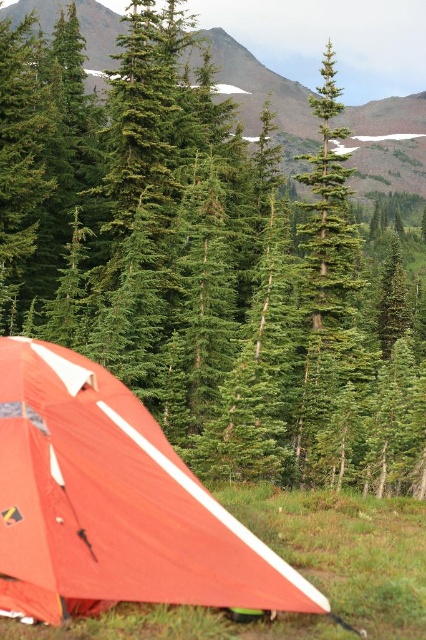
Question: Is orange fabric tent at lower left smaller than green textured pine tree at center?

Choices:
 (A) no
 (B) yes

Answer: (B)

Question: Which point is closer to the camera?

Choices:
 (A) (250, 58)
 (B) (180, 566)

Answer: (B)

Question: Based on their relative distances, which object is farther from the green textured mountain at upper center?

Choices:
 (A) green textured pine tree at center
 (B) orange fabric tent at lower left

Answer: (B)

Question: Is orange fabric tent at lower left thinner than green textured pine tree at center?

Choices:
 (A) no
 (B) yes

Answer: (B)

Question: Is orange fabric tent at lower left closer to the viewer compared to green textured pine tree at center?

Choices:
 (A) yes
 (B) no

Answer: (A)

Question: Which of the following is the closest to the observer?

Choices:
 (A) (19, 353)
 (B) (247, 118)

Answer: (A)